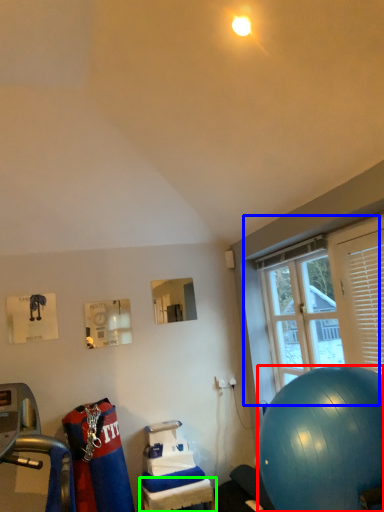
Question: Based on their relative distances, which object is nearer to ball (highlighted by a red box)? Choose from window (highlighted by a blue box) and table (highlighted by a green box).

Choices:
 (A) window
 (B) table

Answer: (A)